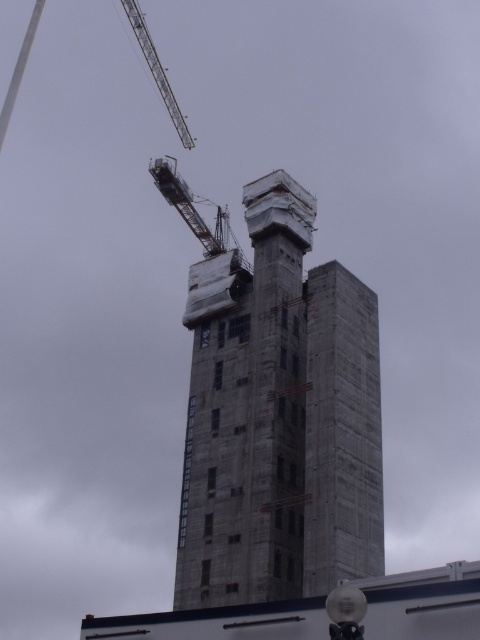
Question: Which of the following is the farthest from the observer?

Choices:
 (A) (179, 212)
 (B) (279, 323)
 (C) (158, 58)

Answer: (C)

Question: Is metallic gray crane at upper left behind metallic gray crane at upper center?

Choices:
 (A) no
 (B) yes

Answer: (B)

Question: Is metallic gray crane at upper left bigger than metallic gray crane at upper center?

Choices:
 (A) no
 (B) yes

Answer: (B)

Question: Considering the real-world distances, which object is closest to the metallic gray crane at upper center?

Choices:
 (A) metallic gray crane at upper left
 (B) concrete at center

Answer: (B)

Question: Which point is farther to the camera?

Choices:
 (A) (1, 131)
 (B) (184, 214)

Answer: (A)

Question: Is concrete at center bigger than metallic gray crane at upper left?

Choices:
 (A) yes
 (B) no

Answer: (B)